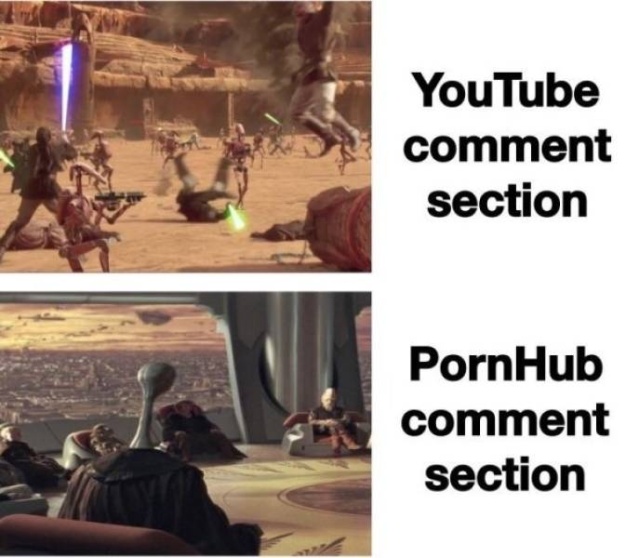
Identify the location of chair. (100, 546), (304, 430), (79, 442).